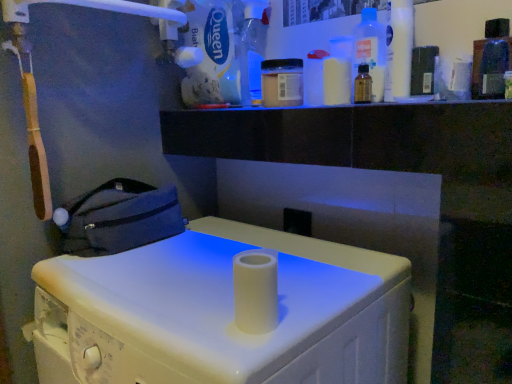
Question: Does translucent plastic bottle at upper right, which is the fifth bottle in left-to-right order, have a lesser width compared to transparent plastic bottle at upper right, which is counted as the 4th bottle, starting from the left?

Choices:
 (A) no
 (B) yes

Answer: (B)

Question: From the image's perspective, is translucent plastic bottle at upper right, the first bottle when ordered from right to left, beneath transparent plastic bottle at upper right, which is counted as the 4th bottle, starting from the left?

Choices:
 (A) yes
 (B) no

Answer: (A)

Question: Can you confirm if translucent plastic bottle at upper right, which is the fifth bottle in left-to-right order, is smaller than transparent plastic bottle at upper right, positioned as the 2th bottle in right-to-left order?

Choices:
 (A) no
 (B) yes

Answer: (B)

Question: Could you tell me if translucent plastic bottle at upper right, which is the fifth bottle in left-to-right order, is facing transparent plastic bottle at upper right, which is counted as the 4th bottle, starting from the left?

Choices:
 (A) no
 (B) yes

Answer: (A)

Question: Is the position of translucent plastic bottle at upper right, which is the fifth bottle in left-to-right order, less distant than that of transparent plastic bottle at upper right, positioned as the 2th bottle in right-to-left order?

Choices:
 (A) no
 (B) yes

Answer: (B)

Question: Looking at the image, does translucent plastic bottle at upper right, which is the fifth bottle in left-to-right order, seem bigger or smaller compared to white matte queen bath cleaner at upper center?

Choices:
 (A) small
 (B) big

Answer: (A)

Question: From the image's perspective, relative to white matte queen bath cleaner at upper center, is translucent plastic bottle at upper right, the first bottle when ordered from right to left, above or below?

Choices:
 (A) below
 (B) above

Answer: (A)

Question: In terms of width, does translucent plastic bottle at upper right, the first bottle when ordered from right to left, look wider or thinner when compared to white matte queen bath cleaner at upper center?

Choices:
 (A) thin
 (B) wide

Answer: (A)

Question: From their relative heights in the image, would you say translucent plastic bottle at upper right, which is the fifth bottle in left-to-right order, is taller or shorter than white matte queen bath cleaner at upper center?

Choices:
 (A) tall
 (B) short

Answer: (B)

Question: In the image, is white matte queen bath cleaner at upper center positioned in front of or behind dark blue fabric bag at left?

Choices:
 (A) behind
 (B) front

Answer: (A)

Question: From a real-world perspective, is white matte queen bath cleaner at upper center above or below dark blue fabric bag at left?

Choices:
 (A) below
 (B) above

Answer: (B)

Question: From their relative heights in the image, would you say white matte queen bath cleaner at upper center is taller or shorter than dark blue fabric bag at left?

Choices:
 (A) short
 (B) tall

Answer: (B)

Question: Considering the positions of white matte queen bath cleaner at upper center and dark blue fabric bag at left in the image, is white matte queen bath cleaner at upper center bigger or smaller than dark blue fabric bag at left?

Choices:
 (A) small
 (B) big

Answer: (B)

Question: Is point (328, 311) positioned closer to the camera than point (357, 38)?

Choices:
 (A) closer
 (B) farther

Answer: (A)

Question: Considering their positions, is white matte paper towel holder at center located in front of or behind transparent plastic bottle at upper right, which is counted as the 4th bottle, starting from the left?

Choices:
 (A) behind
 (B) front

Answer: (B)